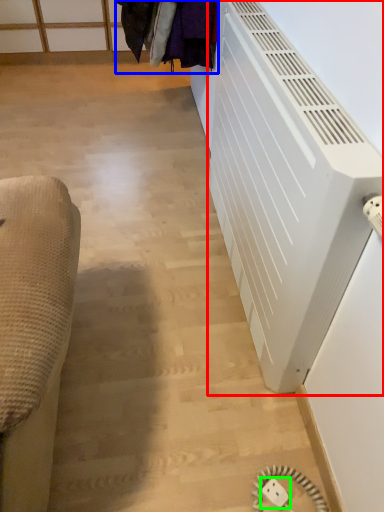
Question: Which is nearer to the air conditioning (highlighted by a red box)? laundry (highlighted by a blue box) or electric outlet (highlighted by a green box).

Choices:
 (A) laundry
 (B) electric outlet

Answer: (A)